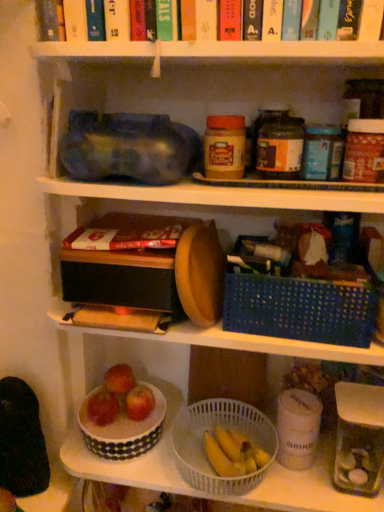
Question: Based on their sizes in the image, would you say shiny red apple at lower center, placed as the 2th apple when sorted from left to right, is bigger or smaller than red matte apple at lower center, the first apple when ordered from left to right?

Choices:
 (A) big
 (B) small

Answer: (B)

Question: Is shiny red apple at lower center, placed as the 2th apple when sorted from left to right, in front of or behind red matte apple at lower center, the first apple when ordered from left to right, in the image?

Choices:
 (A) behind
 (B) front

Answer: (A)

Question: Estimate the real-world distances between objects in this image. Which object is farther from the shiny red apple at lower center, placed as the 2th apple when sorted from left to right?

Choices:
 (A) matte cardboard book at center
 (B) blue plastic basket at center-right, the first basket positioned from the top
 (C) red matte apple at lower center, the 3th apple positioned from the left
 (D) white polka dot bowl at lower center
 (E) white plastic basket at lower center, placed as the 2th basket when sorted from top to bottom

Answer: (B)

Question: Which is nearer to the red matte apple at lower center, the first apple when ordered from left to right?

Choices:
 (A) shiny red apple at lower center, placed as the 2th apple when sorted from left to right
 (B) white plastic basket at lower center, placed as the 2th basket when sorted from top to bottom
 (C) white polka dot bowl at lower center
 (D) clear glass jar at lower right
 (E) matte plastic peanut butter jar at center

Answer: (A)